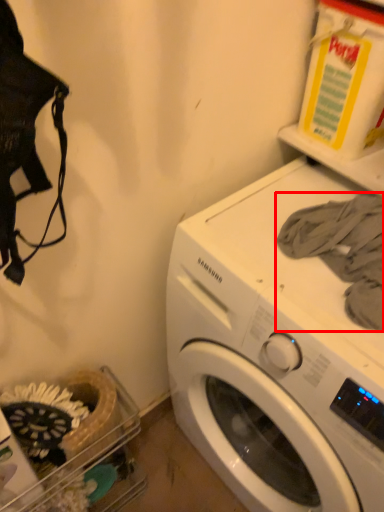
Question: From the image's perspective, where is clothing (annotated by the red box) located relative to washing machine?

Choices:
 (A) below
 (B) above

Answer: (B)